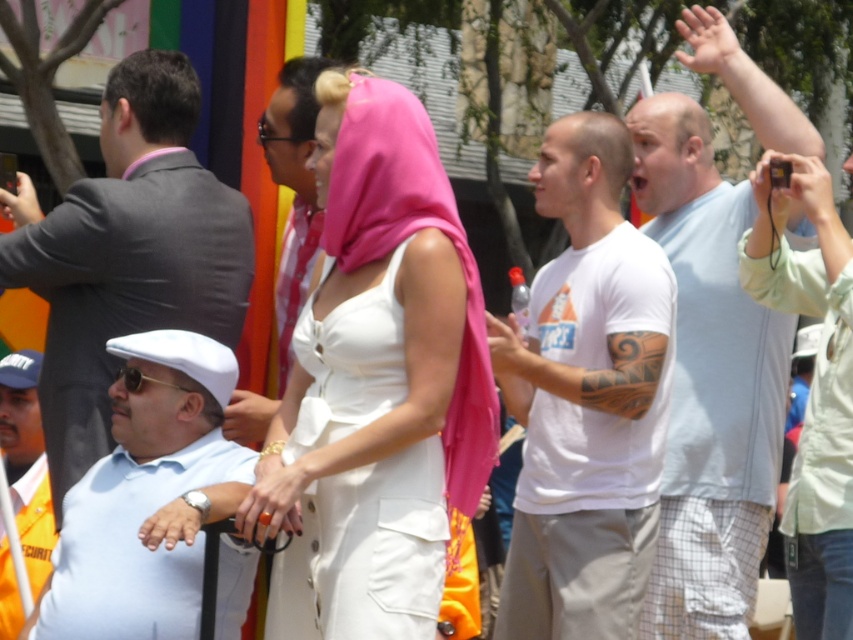
Question: Estimate the real-world distances between objects in this image. Which object is closer to the satin white shirt at center?

Choices:
 (A) black matte phone at left
 (B) matte white dress at center

Answer: (B)

Question: Does white cotton t-shirt at center lie in front of metallic silver camera at upper right?

Choices:
 (A) yes
 (B) no

Answer: (A)

Question: Does matte white hand at center have a lesser width compared to black matte phone at left?

Choices:
 (A) no
 (B) yes

Answer: (A)

Question: Among these objects, which one is nearest to the camera?

Choices:
 (A) pink fabric hand at upper right
 (B) white matte shirt at center
 (C) light blue t-shirt at upper right

Answer: (B)

Question: Which object is farther from the camera taking this photo?

Choices:
 (A) pink fabric hand at upper right
 (B) matte white hand at center
 (C) satin white shirt at center
 (D) white cotton dress at center

Answer: (A)

Question: Is orange matte ring at center to the right of black matte phone at left from the viewer's perspective?

Choices:
 (A) no
 (B) yes

Answer: (B)